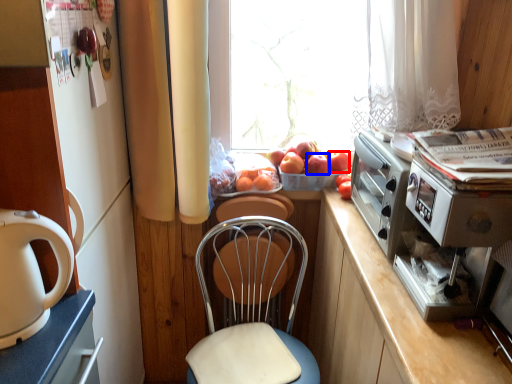
Question: Which of the following is the farthest to the observer, apple (highlighted by a red box) or apple (highlighted by a blue box)?

Choices:
 (A) apple
 (B) apple

Answer: (A)